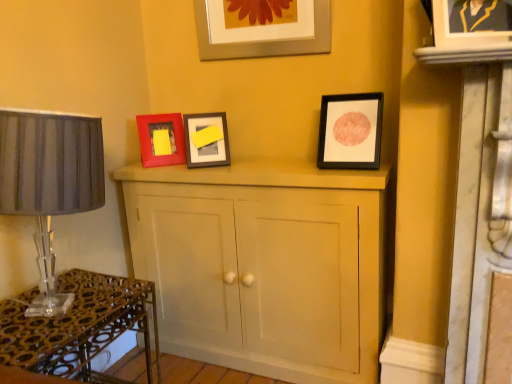
Question: Considering the relative positions of metallic silver picture frame at upper center, placed as the 3th picture frame when sorted from right to left, and matte black picture frame at upper right, arranged as the third picture frame when viewed from the back, in the image provided, is metallic silver picture frame at upper center, placed as the 3th picture frame when sorted from right to left, to the left of matte black picture frame at upper right, arranged as the third picture frame when viewed from the back, from the viewer's perspective?

Choices:
 (A) no
 (B) yes

Answer: (B)

Question: Is metallic silver picture frame at upper center, which is the 3th picture frame from front to back, bigger than matte black picture frame at upper right, which ranks as the 2th picture frame in front-to-back order?

Choices:
 (A) no
 (B) yes

Answer: (B)

Question: Can you confirm if metallic silver picture frame at upper center, the second picture frame from the back, is smaller than matte black picture frame at upper right, which ranks as the 2th picture frame in front-to-back order?

Choices:
 (A) no
 (B) yes

Answer: (A)

Question: From a real-world perspective, does metallic silver picture frame at upper center, the second picture frame from the back, sit lower than matte black picture frame at upper right, which is the second picture frame in right-to-left order?

Choices:
 (A) no
 (B) yes

Answer: (A)

Question: Is metallic silver picture frame at upper center, the second picture frame from the left, with matte black picture frame at upper right, which ranks as the 2th picture frame in front-to-back order?

Choices:
 (A) no
 (B) yes

Answer: (A)

Question: Is metallic silver picture frame at upper center, the second picture frame from the back, wider than matte black picture frame at upper right, the 3th picture frame positioned from the left?

Choices:
 (A) no
 (B) yes

Answer: (A)

Question: Is metallic glass table at lower left taller than matte black picture frame at upper right, positioned as the 1th picture frame in front-to-back order?

Choices:
 (A) no
 (B) yes

Answer: (B)

Question: From a real-world perspective, is metallic glass table at lower left positioned over matte black picture frame at upper right, which ranks as the first picture frame in right-to-left order, based on gravity?

Choices:
 (A) no
 (B) yes

Answer: (A)

Question: Is metallic glass table at lower left facing towards matte black picture frame at upper right, which ranks as the first picture frame in right-to-left order?

Choices:
 (A) no
 (B) yes

Answer: (A)

Question: Considering the relative sizes of metallic glass table at lower left and matte black picture frame at upper right, the fourth picture frame viewed from the left, in the image provided, is metallic glass table at lower left smaller than matte black picture frame at upper right, the fourth picture frame viewed from the left,?

Choices:
 (A) yes
 (B) no

Answer: (B)

Question: Considering the relative sizes of metallic glass table at lower left and matte black picture frame at upper right, the 4th picture frame in the back-to-front sequence, in the image provided, is metallic glass table at lower left wider than matte black picture frame at upper right, the 4th picture frame in the back-to-front sequence,?

Choices:
 (A) no
 (B) yes

Answer: (B)

Question: Is metallic glass table at lower left at the left side of matte black picture frame at upper right, which ranks as the first picture frame in right-to-left order?

Choices:
 (A) no
 (B) yes

Answer: (B)

Question: From a real-world perspective, is matte black picture frame at upper right, which is the second picture frame in right-to-left order, beneath metallic silver picture frame at upper center, the second picture frame from the back?

Choices:
 (A) yes
 (B) no

Answer: (A)